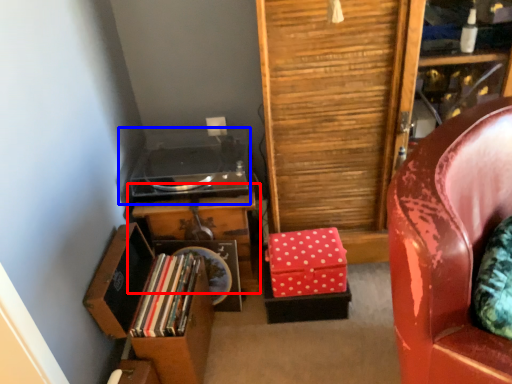
Question: Which object is closer to the camera taking this photo, table (highlighted by a red box) or stereo (highlighted by a blue box)?

Choices:
 (A) table
 (B) stereo

Answer: (B)